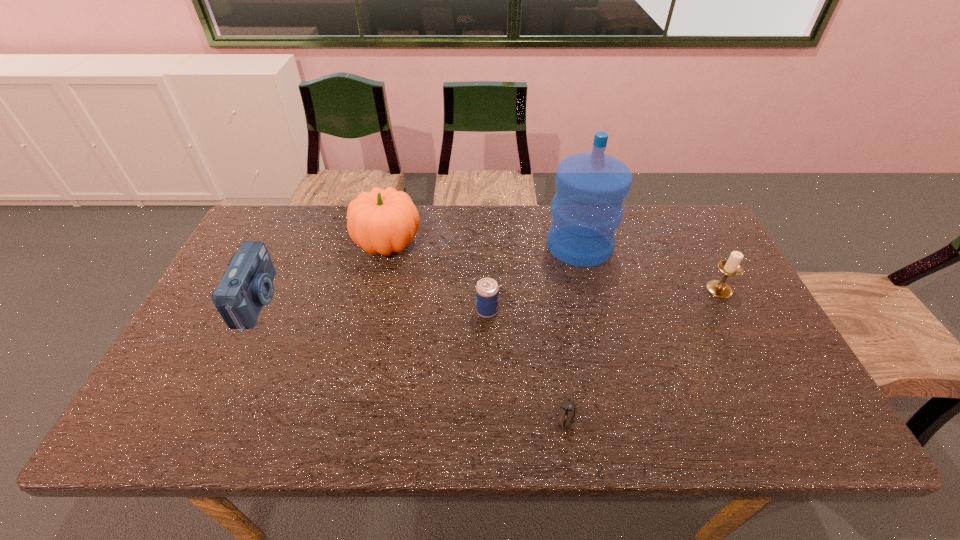
You are a GUI agent. You are given a task and a screenshot of the screen. Output one action in this format:
    pyautogui.click(x=<x>, y=<y>)
    Task: Click on the tallest object
    The image size is (960, 540).
    Given the screenshot: What is the action you would take?
    pyautogui.click(x=587, y=209)

The height and width of the screenshot is (540, 960). In order to click on the fifth object from right to left in this screenshot , I will do `click(380, 221)`.

Locate an element on the screen. The height and width of the screenshot is (540, 960). the fifth shortest object is located at coordinates (380, 221).

This screenshot has height=540, width=960. In order to click on candle holder in this screenshot , I will do `click(731, 267)`.

Locate an element on the screen. The image size is (960, 540). the leftmost object is located at coordinates (247, 285).

Find the location of `beer can`. beer can is located at coordinates (487, 290).

The height and width of the screenshot is (540, 960). I want to click on the fifth tallest object, so click(487, 290).

Where is `computer mouse`? computer mouse is located at coordinates (567, 409).

The image size is (960, 540). Find the location of `the nearest object`. the nearest object is located at coordinates (567, 409).

The height and width of the screenshot is (540, 960). Find the location of `vacant space situated 0.250m on the front of the water jug`. vacant space situated 0.250m on the front of the water jug is located at coordinates (601, 335).